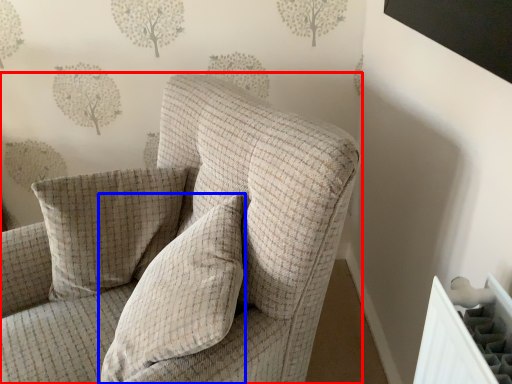
Question: Which point is further to the camera, chair (highlighted by a red box) or pillow (highlighted by a blue box)?

Choices:
 (A) chair
 (B) pillow

Answer: (B)